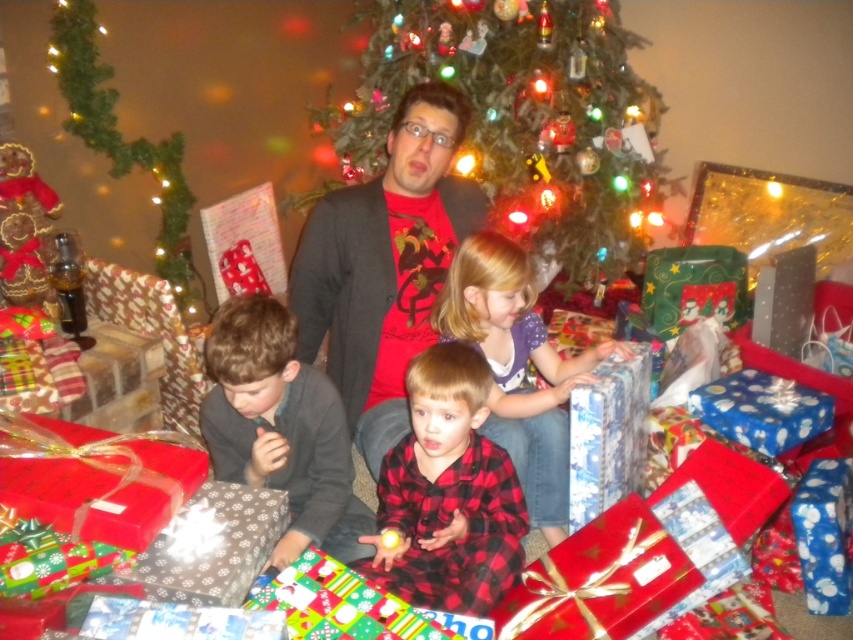
Identify the location of red plaid shirt at center. (448, 492).

Does red plaid shirt at center appear over blue shiny gift at center?

No, red plaid shirt at center is not above blue shiny gift at center.

Where is `red plaid shirt at center`? This screenshot has height=640, width=853. red plaid shirt at center is located at coordinates (448, 492).

Who is more forward, (161,515) or (816,420)?

Point (161,515) is in front.

This screenshot has height=640, width=853. What do you see at coordinates (96, 477) in the screenshot?
I see `shiny red gift at lower left` at bounding box center [96, 477].

The height and width of the screenshot is (640, 853). What are the coordinates of `shiny red gift at lower left` in the screenshot? It's located at (96, 477).

Does matte black sweater at center appear on the left side of shiny red gift at lower left?

In fact, matte black sweater at center is to the right of shiny red gift at lower left.

Which is more to the left, matte black sweater at center or shiny red gift at lower left?

From the viewer's perspective, shiny red gift at lower left appears more on the left side.

Who is more distant from viewer, (422, 198) or (80, 452)?

The point (422, 198) is behind.

At what (x,y) coordinates should I click in order to perform the action: click on matte black sweater at center. Please return your answer as a coordinate pair (x, y). Image resolution: width=853 pixels, height=640 pixels. Looking at the image, I should click on (384, 264).